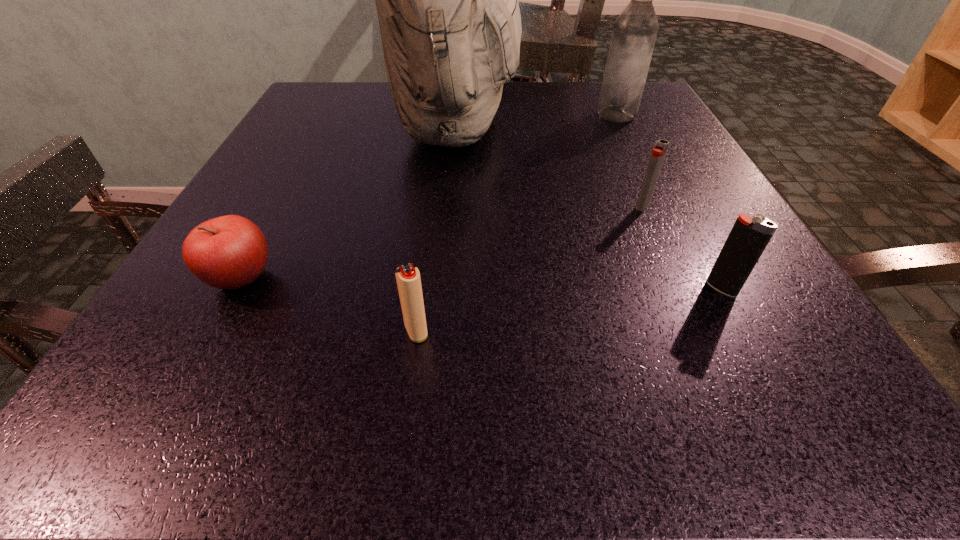
Identify the location of vacant space that is in between the leftmost object and the second nearest igniter. (481, 284).

The width and height of the screenshot is (960, 540). What are the coordinates of `free space between the second igniter from right to left and the nearest object` in the screenshot? It's located at (529, 268).

Locate an element on the screen. This screenshot has width=960, height=540. empty space between the rightmost igniter and the fifth shortest object is located at coordinates (669, 201).

At what (x,y) coordinates should I click in order to perform the action: click on free space between the tallest object and the fourth nearest object. Please return your answer as a coordinate pair (x, y). The image size is (960, 540). Looking at the image, I should click on (549, 166).

Identify the location of vacant area that lies between the nearest object and the second farthest igniter. Image resolution: width=960 pixels, height=540 pixels. (568, 309).

The image size is (960, 540). I want to click on object that stands as the third closest to the nearest igniter, so (x=749, y=236).

Identify which object is located as the fourth nearest to the second farthest igniter. Please provide its 2D coordinates. Your answer should be formatted as a tuple, i.e. [(x, y)], where the tuple contains the x and y coordinates of a point satisfying the conditions above.

[(635, 30)]

Select which igniter is the closest to the fifth shortest object. Please provide its 2D coordinates. Your answer should be formatted as a tuple, i.e. [(x, y)], where the tuple contains the x and y coordinates of a point satisfying the conditions above.

[(659, 151)]

Where is `igniter object that ranks as the closest to the farthest igniter`? The height and width of the screenshot is (540, 960). igniter object that ranks as the closest to the farthest igniter is located at coordinates point(749,236).

Find the location of a particular element. free space that satisfies the following two spatial constraints: 1. on the back side of the fifth shortest object; 2. on the left side of the third farthest object is located at coordinates (603, 114).